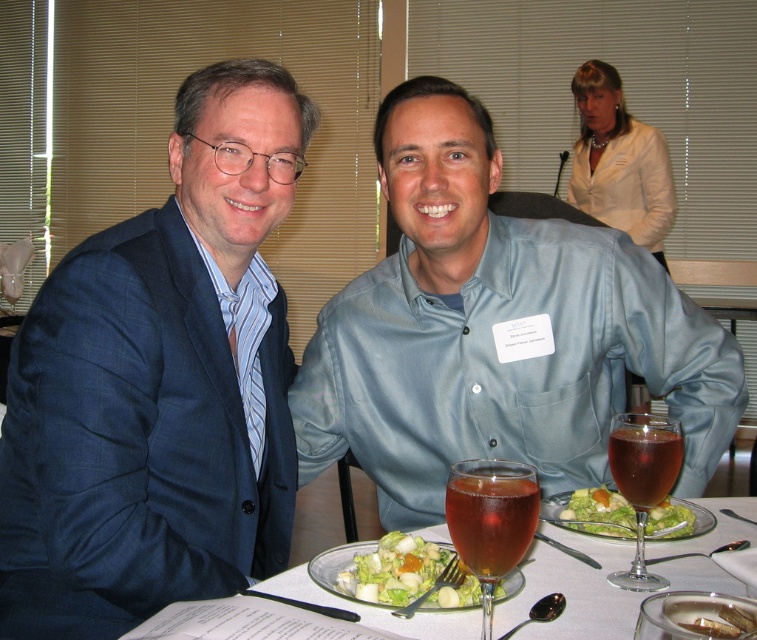
You are a photographer standing behind the two people at the table. You want to take a photo that includes both the light blue shirt at center and the fresh green salad at center. Which object should you focus on first if you want to ensure both are in frame?

The light blue shirt at center is larger in size than the fresh green salad at center, so you should focus on the light blue shirt at center first to ensure both are in frame.

You are a photographer standing behind the two people at the table. You need to take a photo that includes both the light blue shirt at center and the fresh green salad at center. Which object should be placed closer to the camera to ensure both are fully visible in the photo?

The light blue shirt at center is taller than the fresh green salad at center, so to ensure both are fully visible in the photo, the fresh green salad at center should be placed closer to the camera.